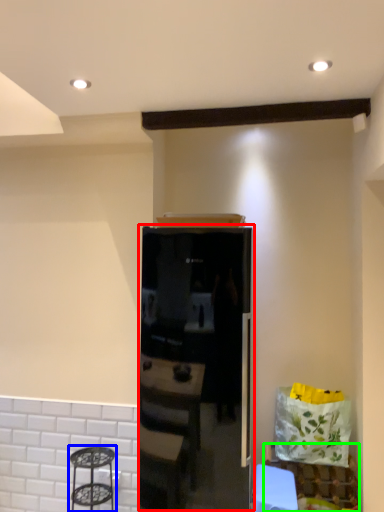
Question: Which object is the farthest from appliance (highlighted by a red box)? Choose among these: step stool (highlighted by a blue box) or furniture (highlighted by a green box).

Choices:
 (A) step stool
 (B) furniture

Answer: (B)